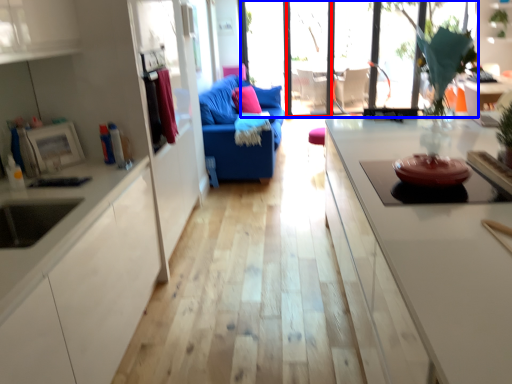
Question: Among these objects, which one is farthest to the camera, glass door (highlighted by a red box) or window (highlighted by a blue box)?

Choices:
 (A) glass door
 (B) window

Answer: (A)